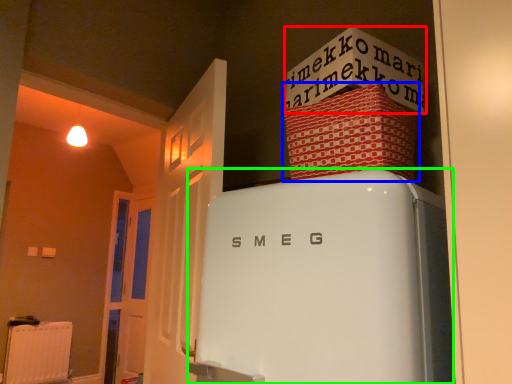
Question: Which is nearer to the writing (highlighted by a red box)? cardboard box (highlighted by a blue box) or refrigerator (highlighted by a green box).

Choices:
 (A) cardboard box
 (B) refrigerator

Answer: (A)